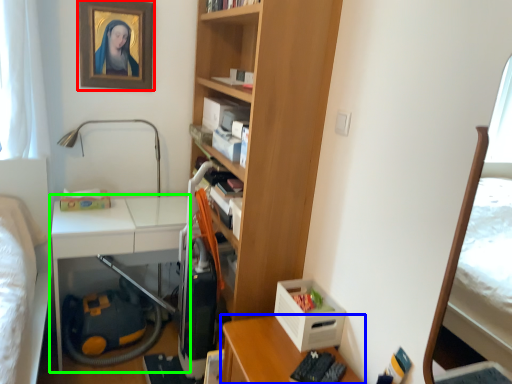
Question: Considering the real-world distances, which object is farthest from picture frame (highlighted by a red box)? desk (highlighted by a blue box) or table (highlighted by a green box)?

Choices:
 (A) desk
 (B) table

Answer: (A)